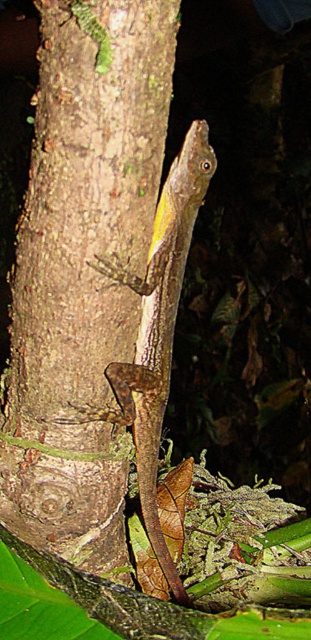
Question: Considering the relative positions of brown rough tree trunk at center and brown textured lizard at center in the image provided, where is brown rough tree trunk at center located with respect to brown textured lizard at center?

Choices:
 (A) above
 (B) below

Answer: (A)

Question: Where is brown rough tree trunk at center located in relation to brown textured lizard at center in the image?

Choices:
 (A) above
 (B) below

Answer: (A)

Question: Which object is farther from the camera taking this photo?

Choices:
 (A) brown textured lizard at center
 (B) brown rough tree trunk at center

Answer: (A)

Question: Considering the relative positions of brown rough tree trunk at center and brown textured lizard at center in the image provided, where is brown rough tree trunk at center located with respect to brown textured lizard at center?

Choices:
 (A) left
 (B) right

Answer: (A)

Question: Among these objects, which one is nearest to the camera?

Choices:
 (A) brown textured lizard at center
 (B) brown rough tree trunk at center

Answer: (B)